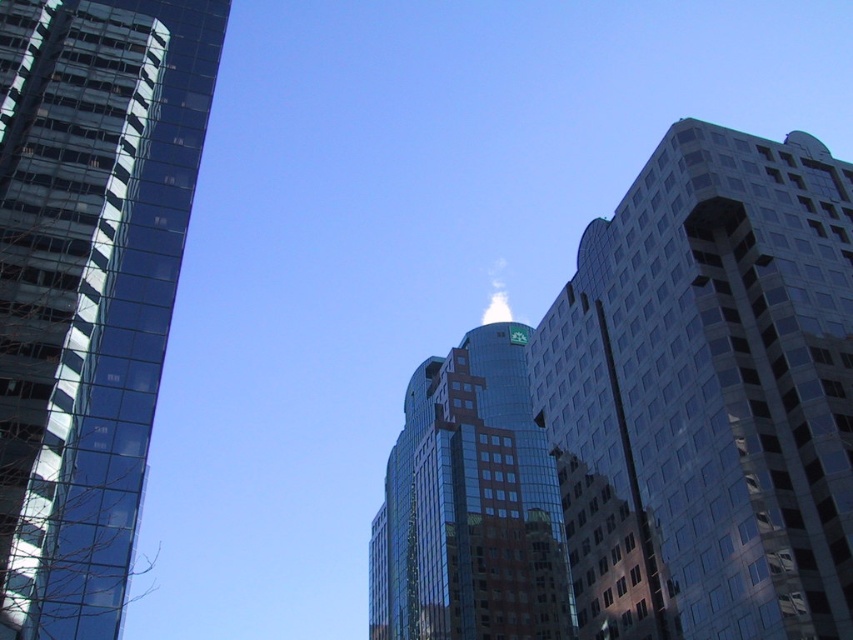
Does glassy blue skyscraper at right have a greater width compared to shiny glass skyscraper at left?

Indeed, glassy blue skyscraper at right has a greater width compared to shiny glass skyscraper at left.

What do you see at coordinates (718, 380) in the screenshot? I see `glassy blue skyscraper at right` at bounding box center [718, 380].

Is point (589, 224) closer to viewer compared to point (163, 132)?

No.

The height and width of the screenshot is (640, 853). I want to click on glassy blue skyscraper at right, so click(x=718, y=380).

Measure the distance between glassy blue skyscraper at right and glassy reflective building at center.

A distance of 50.71 meters exists between glassy blue skyscraper at right and glassy reflective building at center.

Can you confirm if glassy blue skyscraper at right is smaller than glassy reflective building at center?

Correct, glassy blue skyscraper at right occupies less space than glassy reflective building at center.

Who is more distant from viewer, (746, 476) or (463, 596)?

Point (463, 596)

Where is `glassy blue skyscraper at right`? The height and width of the screenshot is (640, 853). glassy blue skyscraper at right is located at coordinates (718, 380).

Can you confirm if shiny glass skyscraper at left is taller than glassy reflective building at center?

In fact, shiny glass skyscraper at left may be shorter than glassy reflective building at center.

Find the location of a particular element. shiny glass skyscraper at left is located at coordinates (88, 284).

Find the location of a particular element. This screenshot has width=853, height=640. shiny glass skyscraper at left is located at coordinates (x=88, y=284).